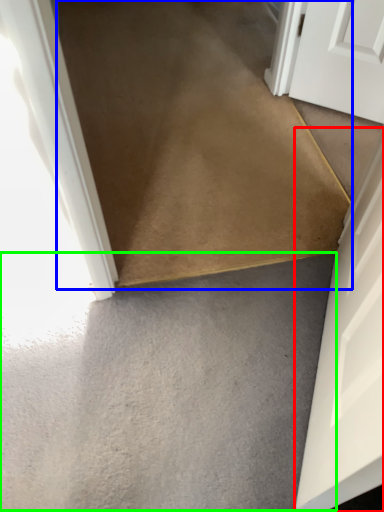
Question: Which object is positioned closest to door (highlighted by a red box)? Select from path (highlighted by a blue box) and concrete (highlighted by a green box).

Choices:
 (A) path
 (B) concrete

Answer: (B)